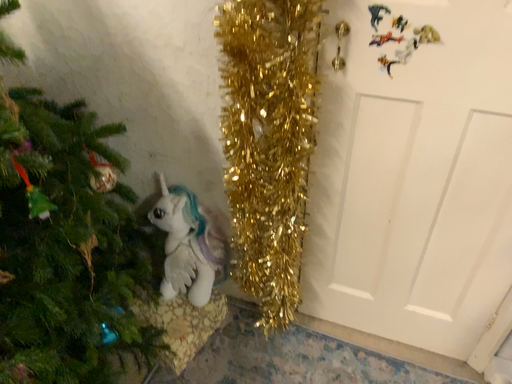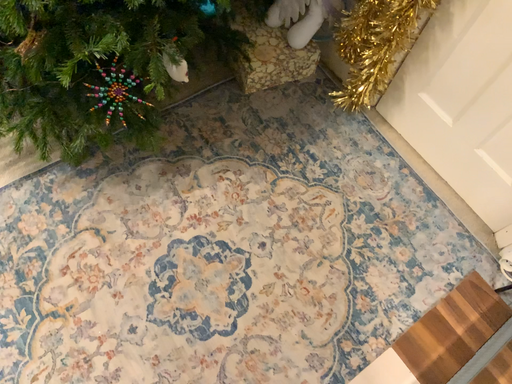
Question: Which way did the camera rotate in the video?

Choices:
 (A) rotated downward
 (B) rotated upward

Answer: (A)